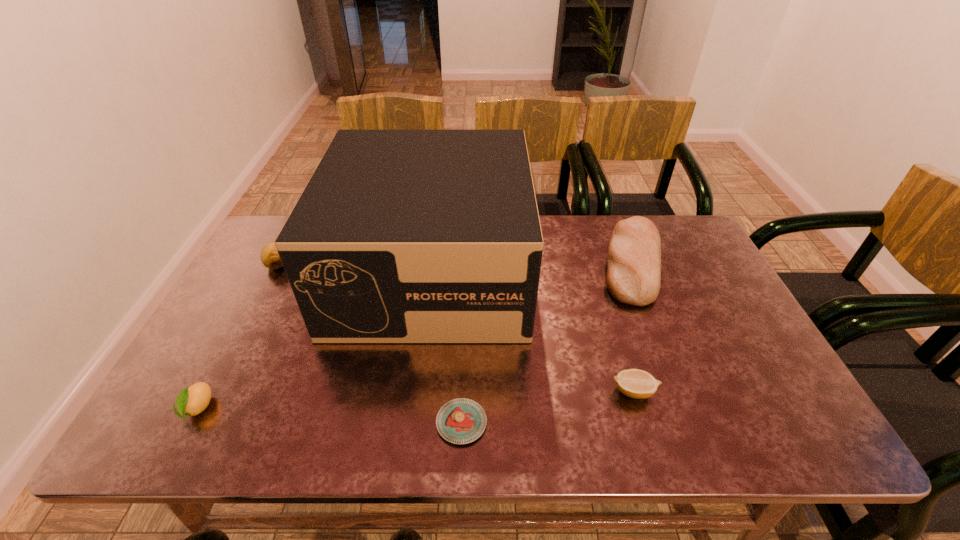
Locate an element on the screen. free space at the left edge of the desktop is located at coordinates (222, 368).

The image size is (960, 540). I want to click on free location at the right edge of the desktop, so click(708, 330).

You are a GUI agent. You are given a task and a screenshot of the screen. Output one action in this format:
    pyautogui.click(x=<x>, y=<y>)
    Task: Click on the free space at the near right corner
    
    Given the screenshot: What is the action you would take?
    point(794,428)

What are the coordinates of `vacant area between the fifth shortest object and the second shortest object` in the screenshot? It's located at (633, 327).

At what (x,y) coordinates should I click in order to perform the action: click on vacant region between the shortest lemon and the bread. Please return your answer as a coordinate pair (x, y). The height and width of the screenshot is (540, 960). Looking at the image, I should click on (633, 327).

Locate which object is the closest to the fifth shortest object. Please provide its 2D coordinates. Your answer should be formatted as a tuple, i.e. [(x, y)], where the tuple contains the x and y coordinates of a point satisfying the conditions above.

[(634, 383)]

Find the location of a particular element. The height and width of the screenshot is (540, 960). the third closest object relative to the box is located at coordinates (634, 383).

Choose which lemon is the nearest neighbor to the bread. Please provide its 2D coordinates. Your answer should be formatted as a tuple, i.e. [(x, y)], where the tuple contains the x and y coordinates of a point satisfying the conditions above.

[(634, 383)]

Locate which lemon ranks in proximity to the second shortest object. Please provide its 2D coordinates. Your answer should be formatted as a tuple, i.e. [(x, y)], where the tuple contains the x and y coordinates of a point satisfying the conditions above.

[(191, 401)]

Identify the location of blank space that satisfies the following two spatial constraints: 1. at the stem end of the pastry; 2. on the left side of the farthest lemon. (194, 422).